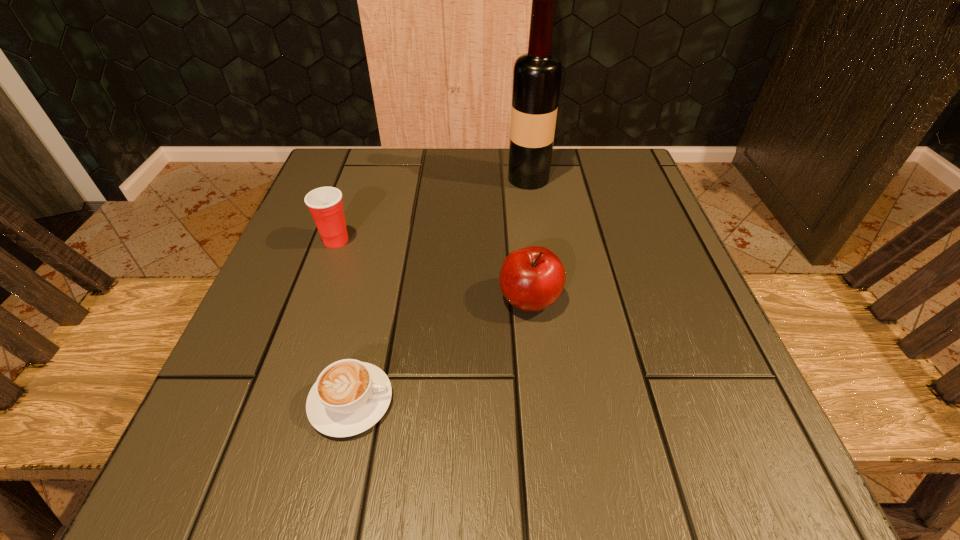
Find the location of a particular element. The width and height of the screenshot is (960, 540). vacant area at the far left corner is located at coordinates (378, 206).

This screenshot has width=960, height=540. In order to click on vacant area at the far right corner in this screenshot , I will do `click(612, 182)`.

Where is `unoccupied position between the tallest object and the second nearest object`? unoccupied position between the tallest object and the second nearest object is located at coordinates (529, 239).

What are the coordinates of `vacant space that's between the tallest object and the Dixie cup` in the screenshot? It's located at point(432,210).

Image resolution: width=960 pixels, height=540 pixels. I want to click on free space between the Dixie cup and the wine bottle, so click(432, 210).

This screenshot has width=960, height=540. I want to click on free space that is in between the tallest object and the second nearest object, so click(x=529, y=239).

Locate an element on the screen. vacant area that lies between the third nearest object and the nearest object is located at coordinates (344, 321).

Where is `unoccupied area between the second farthest object and the farthest object`? unoccupied area between the second farthest object and the farthest object is located at coordinates (432, 210).

The width and height of the screenshot is (960, 540). Identify the location of vacant area that lies between the third object from right to left and the second nearest object. (441, 350).

You are a GUI agent. You are given a task and a screenshot of the screen. Output one action in this format:
    pyautogui.click(x=<x>, y=<y>)
    Task: Click on the vacant region between the shortest object and the Dixie cup
    
    Given the screenshot: What is the action you would take?
    [x=344, y=321]